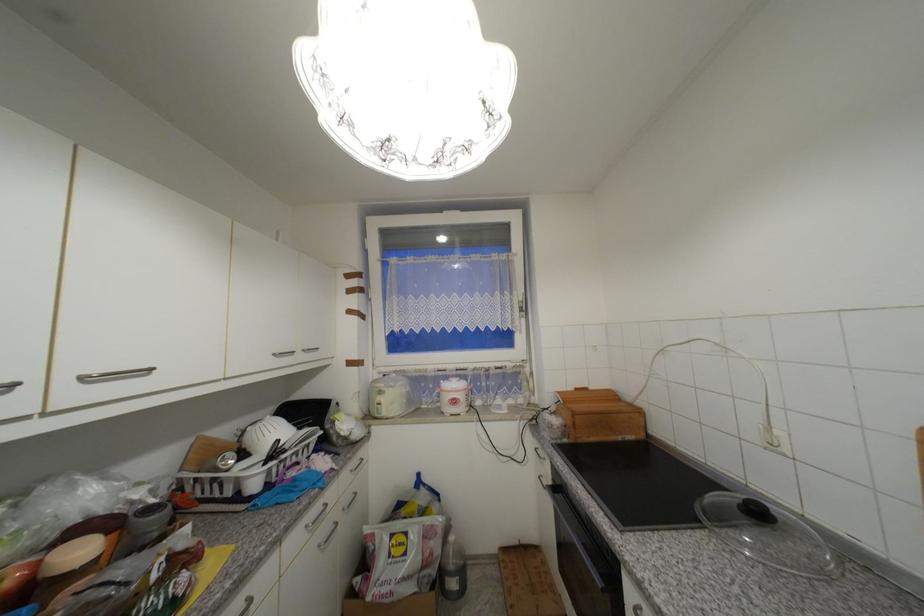
Locate an element on the screen. Image resolution: width=924 pixels, height=616 pixels. oven door handle is located at coordinates (576, 533).